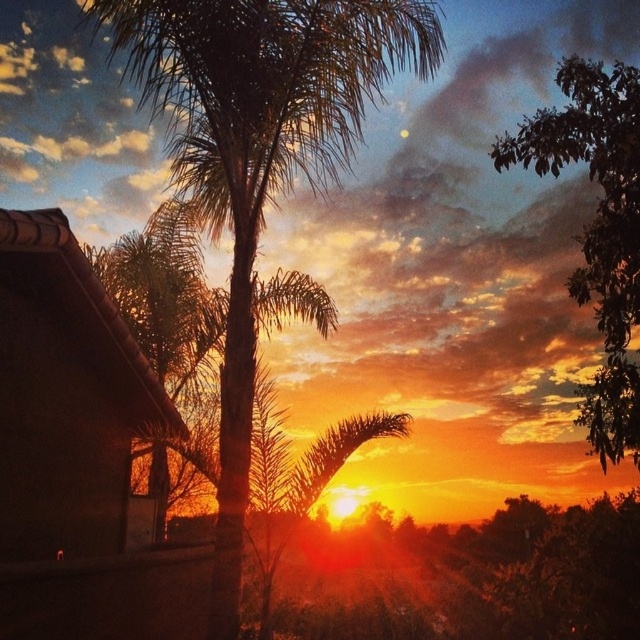
Between point (236, 60) and point (627, 355), which one is positioned in front?

Positioned in front is point (236, 60).

How far apart are green leafy palm tree at center and green leafy tree at upper right?

They are 5.54 meters apart.

Does point (336, 109) lie in front of point (557, 74)?

Yes, point (336, 109) is in front of point (557, 74).

At what (x,y) coordinates should I click in order to perform the action: click on green leafy palm tree at center. Please return your answer as a coordinate pair (x, y). Looking at the image, I should click on (259, 152).